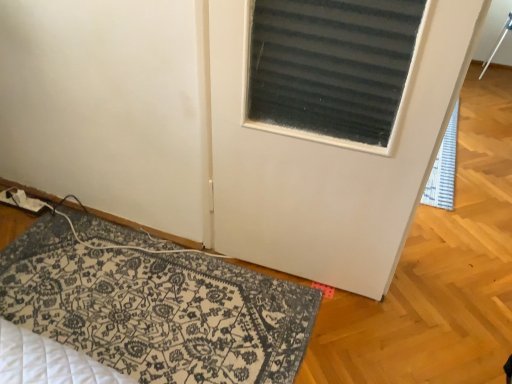
The width and height of the screenshot is (512, 384). I want to click on free spot below patterned fabric mat at lower left (from a real-world perspective), so click(162, 309).